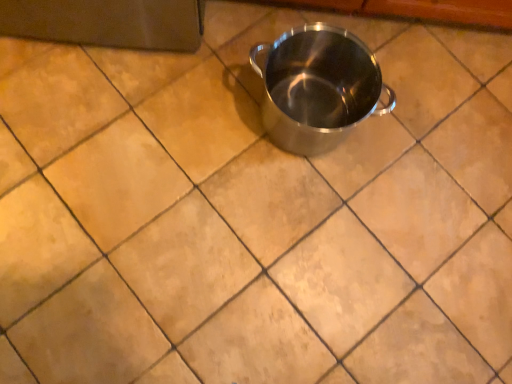
Locate an element on the screen. vacant space underneath shiny metallic pot at center (from a real-world perspective) is located at coordinates (295, 117).